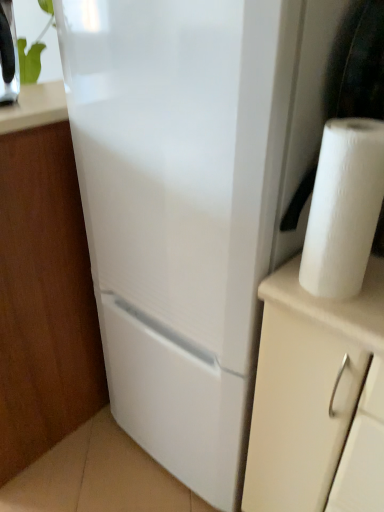
Question: Relative to green leafy plant at upper left, is white matte cabinet at lower left in front or behind?

Choices:
 (A) behind
 (B) front

Answer: (B)

Question: In the image, is white matte cabinet at lower left on the left side or the right side of green leafy plant at upper left?

Choices:
 (A) right
 (B) left

Answer: (B)

Question: Which of these objects is positioned farthest from the white matte cabinet at lower left?

Choices:
 (A) green leafy plant at upper left
 (B) white paper at right

Answer: (A)

Question: Estimate the real-world distances between objects in this image. Which object is farther from the green leafy plant at upper left?

Choices:
 (A) white paper at right
 (B) white matte cabinet at lower left

Answer: (A)